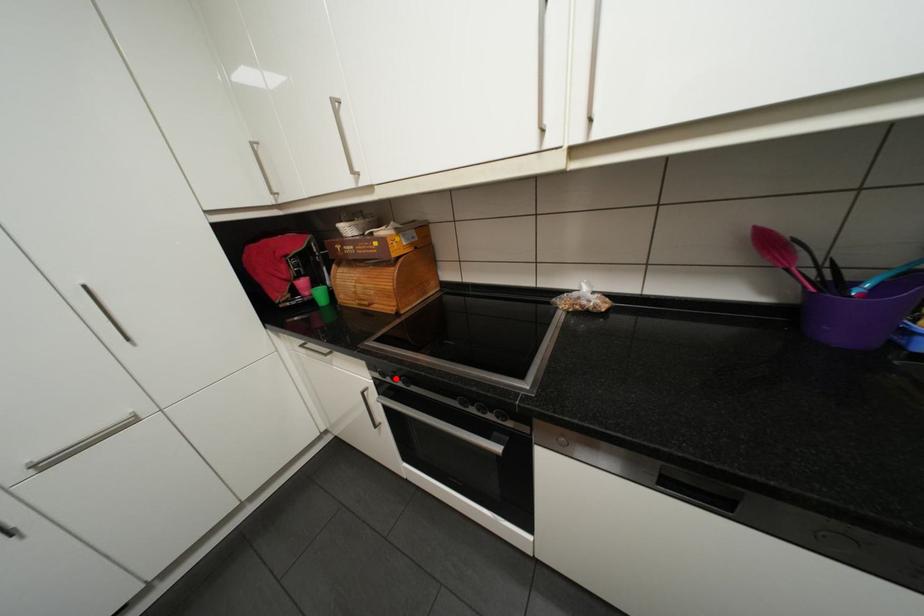
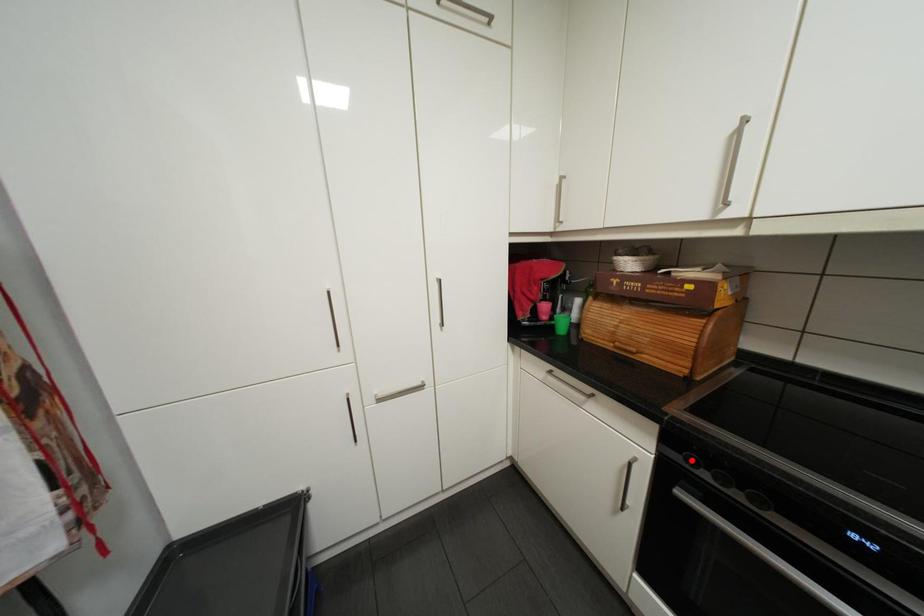
I am providing you with two images of the same scene from different viewpoints. A red point is marked on the first image and another point is marked on the second image. Are the points marked in image1 and image2 representing the same 3D position?

No